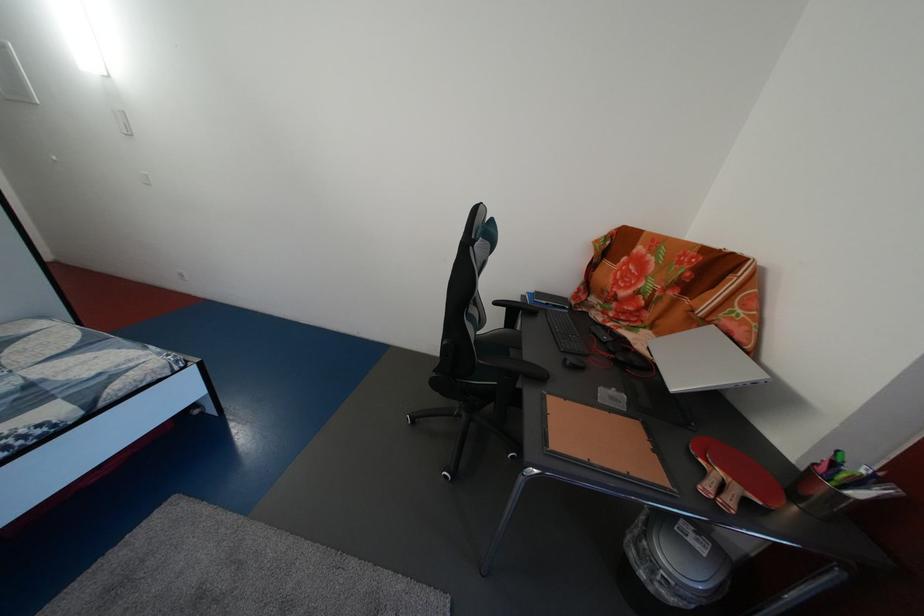
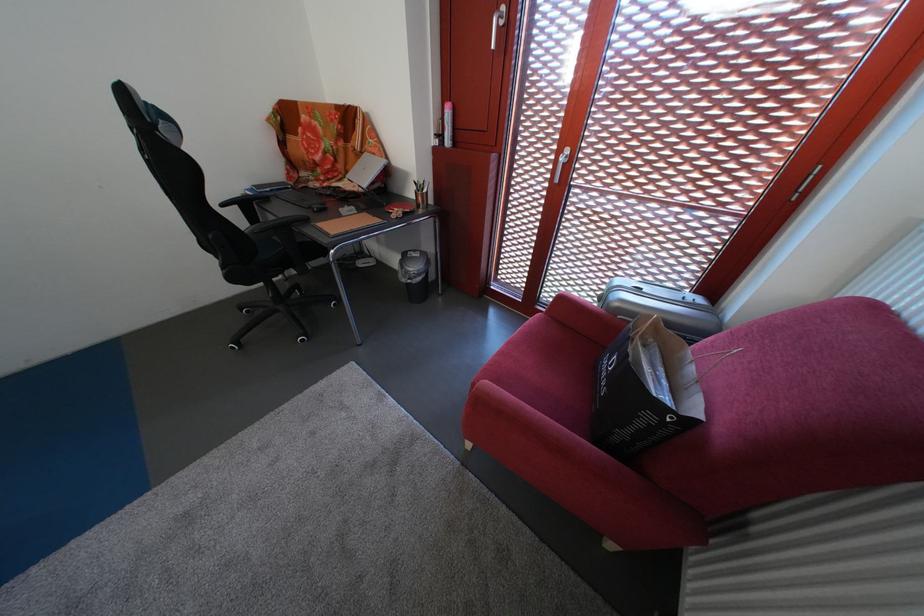
Based on the continuous images, in which direction is the camera rotating?

The rotation direction of the camera is right-down.